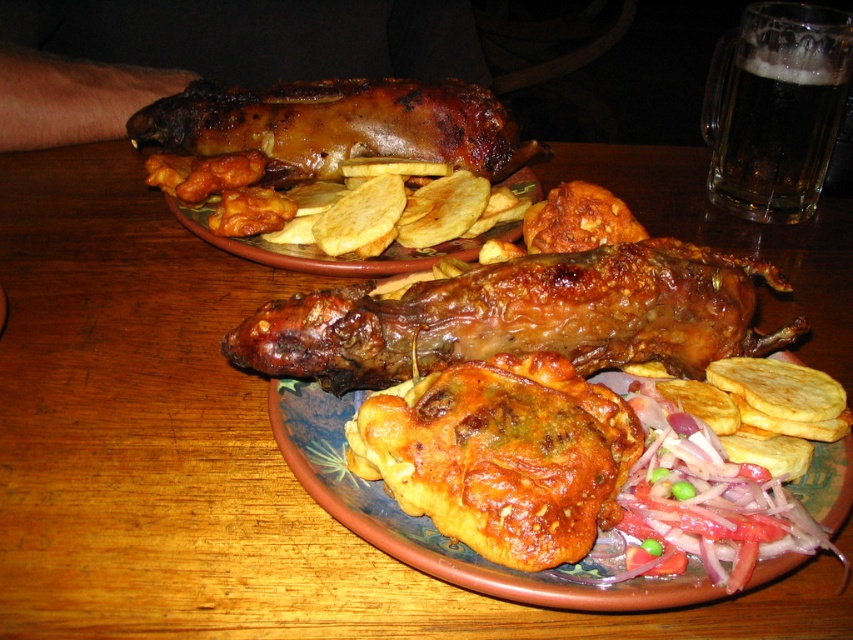
From the picture: Who is lower down, golden-brown crispy chicken at center or golden-brown crispy potato chips at center?

golden-brown crispy chicken at center is lower down.

Who is positioned more to the left, golden-brown crispy chicken at center or golden-brown crispy potato chips at center?

Positioned to the left is golden-brown crispy potato chips at center.

Where is `golden-brown crispy chicken at center`? This screenshot has width=853, height=640. golden-brown crispy chicken at center is located at coordinates (502, 456).

Is brown crispy pork at upper center positioned in front of foamy dark brown glass at upper right?

Yes, it is in front of foamy dark brown glass at upper right.

Is brown crispy pork at upper center positioned at the back of foamy dark brown glass at upper right?

No.

Is point (198, 108) positioned after point (706, 192)?

No, (198, 108) is closer to viewer.

Locate an element on the screen. The width and height of the screenshot is (853, 640). brown crispy pork at upper center is located at coordinates (335, 125).

Is the position of brown crispy chicken wing at center less distant than that of brown crispy pork at upper center?

That is True.

Is brown crispy chicken wing at center to the right of brown crispy pork at upper center from the viewer's perspective?

Correct, you'll find brown crispy chicken wing at center to the right of brown crispy pork at upper center.

Who is more forward, (569, 253) or (477, 148)?

Point (569, 253)

At what (x,y) coordinates should I click in order to perform the action: click on brown crispy chicken wing at center. Please return your answer as a coordinate pair (x, y). Looking at the image, I should click on click(521, 317).